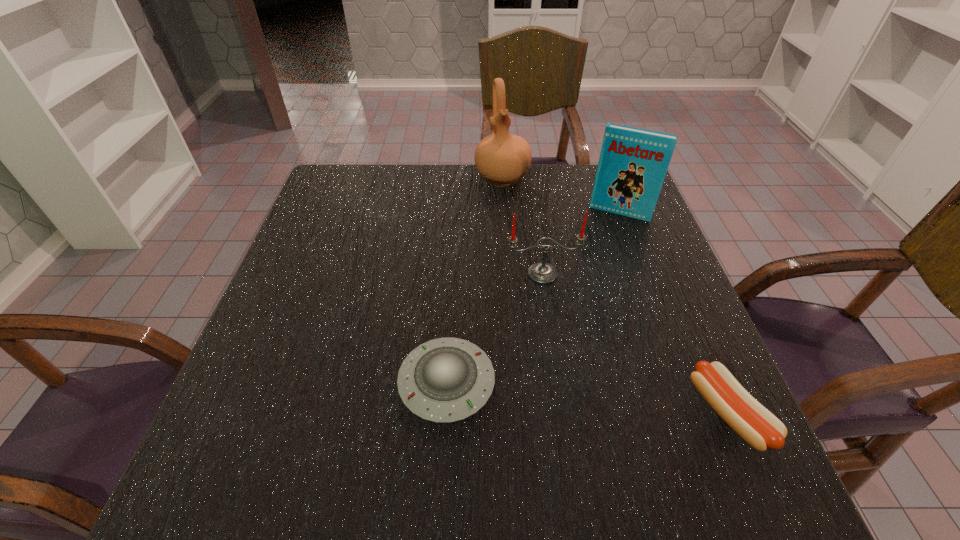
Locate an element on the screen. saucer is located at coordinates (444, 380).

Image resolution: width=960 pixels, height=540 pixels. Find the location of `sausage`. sausage is located at coordinates (756, 425).

Where is `the second farthest object`? This screenshot has height=540, width=960. the second farthest object is located at coordinates (633, 162).

At what (x,y) coordinates should I click in order to perform the action: click on candle. Please return your answer as a coordinate pair (x, y). Image resolution: width=960 pixels, height=540 pixels. Looking at the image, I should click on (541, 272).

The height and width of the screenshot is (540, 960). Identify the location of the third shortest object. (541, 272).

What are the coordinates of `the farthest object` in the screenshot? It's located at (502, 158).

The height and width of the screenshot is (540, 960). I want to click on free point located on the left of the saucer, so click(x=291, y=383).

The image size is (960, 540). Find the location of `vacant area located 0.190m on the left of the sausage`. vacant area located 0.190m on the left of the sausage is located at coordinates (587, 413).

You are a GUI agent. You are given a task and a screenshot of the screen. Output one action in this format:
    pyautogui.click(x=<x>, y=<y>)
    Task: Click on the free point located 0.360m on the front cover of the book
    
    Given the screenshot: What is the action you would take?
    pyautogui.click(x=575, y=319)

This screenshot has height=540, width=960. I want to click on blank space located 0.200m on the front cover of the book, so click(x=593, y=270).